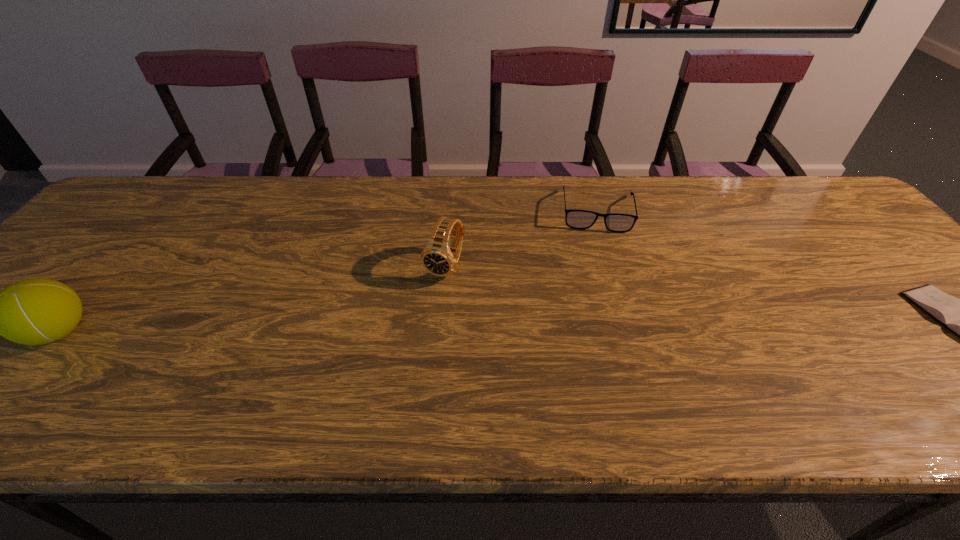
I want to click on free spot on the desktop that is between the leftmost object and the shortest object and is positioned on the front-facing side of the farthest object, so click(x=608, y=326).

At what (x,y) coordinates should I click in order to perform the action: click on vacant space on the desktop that is between the leftmost object and the diary and is positioned on the face of the second object from left to right. Please return your answer as a coordinate pair (x, y). The image size is (960, 540). Looking at the image, I should click on (413, 328).